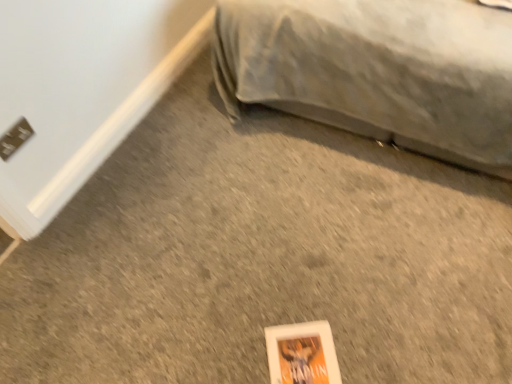
Question: Is gray fabric bed at upper right wider than white matte paperback book at lower center?

Choices:
 (A) no
 (B) yes

Answer: (B)

Question: Is gray fabric bed at upper right directly adjacent to white matte paperback book at lower center?

Choices:
 (A) yes
 (B) no

Answer: (B)

Question: From the image's perspective, would you say gray fabric bed at upper right is positioned over white matte paperback book at lower center?

Choices:
 (A) yes
 (B) no

Answer: (A)

Question: Can you confirm if gray fabric bed at upper right is thinner than white matte paperback book at lower center?

Choices:
 (A) no
 (B) yes

Answer: (A)

Question: Can you confirm if gray fabric bed at upper right is smaller than white matte paperback book at lower center?

Choices:
 (A) no
 (B) yes

Answer: (A)

Question: From a real-world perspective, is gray fabric bed at upper right physically above white matte paperback book at lower center?

Choices:
 (A) no
 (B) yes

Answer: (B)

Question: Does metallic gray electric outlet at lower left have a lesser height compared to gray fabric bed at upper right?

Choices:
 (A) no
 (B) yes

Answer: (B)

Question: From a real-world perspective, does metallic gray electric outlet at lower left sit lower than gray fabric bed at upper right?

Choices:
 (A) yes
 (B) no

Answer: (A)

Question: Does metallic gray electric outlet at lower left have a greater height compared to gray fabric bed at upper right?

Choices:
 (A) yes
 (B) no

Answer: (B)

Question: Does metallic gray electric outlet at lower left have a lesser width compared to gray fabric bed at upper right?

Choices:
 (A) yes
 (B) no

Answer: (A)

Question: From the image's perspective, is metallic gray electric outlet at lower left above gray fabric bed at upper right?

Choices:
 (A) no
 (B) yes

Answer: (A)

Question: Is the position of metallic gray electric outlet at lower left less distant than that of gray fabric bed at upper right?

Choices:
 (A) no
 (B) yes

Answer: (A)

Question: Is gray fabric bed at upper right thinner than metallic gray electric outlet at lower left?

Choices:
 (A) yes
 (B) no

Answer: (B)